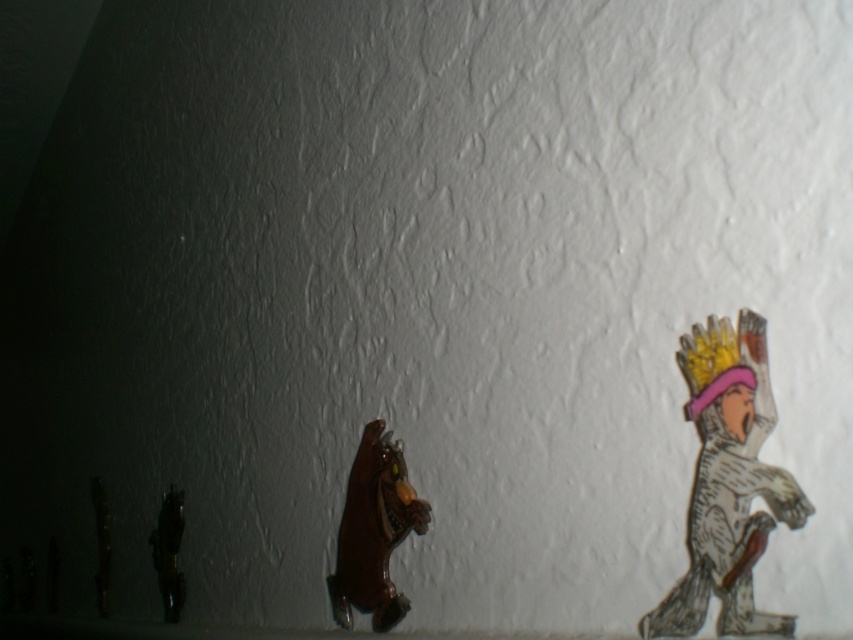
Can you confirm if brown glossy bear at center is positioned to the left of shiny black figurine at left?

No, brown glossy bear at center is not to the left of shiny black figurine at left.

Which is in front, point (387, 538) or point (165, 596)?

Point (387, 538) is in front.

Is point (386, 570) behind point (172, 586)?

No, it is not.

Find the location of a particular element. The height and width of the screenshot is (640, 853). brown glossy bear at center is located at coordinates 374,531.

Between wooden crown figure at right and shiny black figurine at left, which one is positioned higher?

wooden crown figure at right is above.

Is wooden crown figure at right to the left of shiny black figurine at left from the viewer's perspective?

Incorrect, wooden crown figure at right is not on the left side of shiny black figurine at left.

Who is more distant from viewer, (x=712, y=401) or (x=160, y=572)?

Point (x=160, y=572)

You are a GUI agent. You are given a task and a screenshot of the screen. Output one action in this format:
    pyautogui.click(x=<x>, y=<y>)
    Task: Click on the wooden crown figure at right
    The image size is (853, 640).
    Given the screenshot: What is the action you would take?
    pyautogui.click(x=728, y=483)

Who is positioned more to the right, wooden crown figure at right or brown glossy bear at center?

wooden crown figure at right

Between point (688, 589) and point (393, 499), which one is positioned behind?

Point (393, 499)

What are the coordinates of `wooden crown figure at right` in the screenshot? It's located at (728, 483).